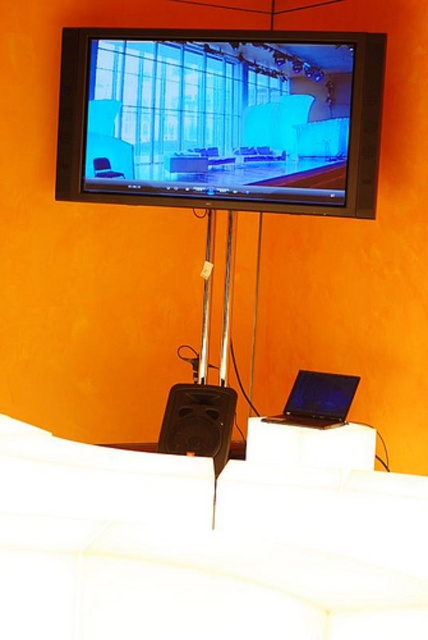
Is white fabric couch at lower center bigger than black matte laptop at lower center?

Yes.

Which is more to the left, white fabric couch at lower center or black matte laptop at lower center?

white fabric couch at lower center is more to the left.

Image resolution: width=428 pixels, height=640 pixels. What are the coordinates of `white fabric couch at lower center` in the screenshot? It's located at (199, 548).

Can you confirm if flat-screen tv at upper center is smaller than black matte laptop at lower center?

Actually, flat-screen tv at upper center might be larger than black matte laptop at lower center.

Is flat-screen tv at upper center bigger than black matte laptop at lower center?

Yes, flat-screen tv at upper center is bigger than black matte laptop at lower center.

Image resolution: width=428 pixels, height=640 pixels. Identify the location of flat-screen tv at upper center. (220, 120).

Does point (186, 632) lie behind point (106, 86)?

That is False.

Who is positioned more to the right, white fabric couch at lower center or flat-screen tv at upper center?

From the viewer's perspective, flat-screen tv at upper center appears more on the right side.

Where is `white fabric couch at lower center`? white fabric couch at lower center is located at coordinates (199, 548).